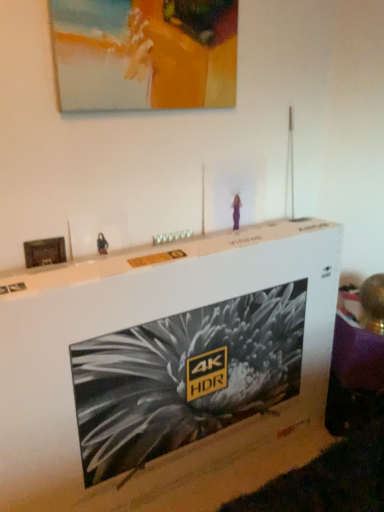
Find the location of a particular element. The image size is (384, 512). free spot above white cardboard box at center (from a real-world perspective) is located at coordinates (173, 250).